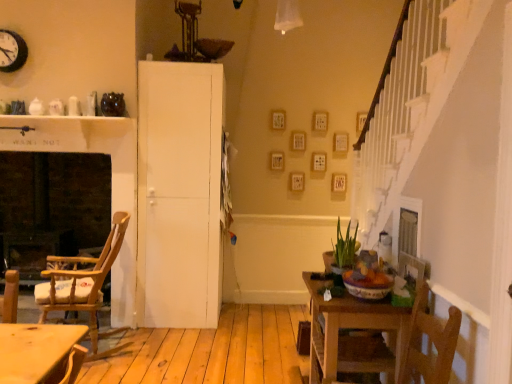
At what (x,y) coordinates should I click in order to perform the action: click on wooden rocking chair at left. Please return your answer as a coordinate pair (x, y). Image resolution: width=512 pixels, height=384 pixels. Looking at the image, I should click on (80, 280).

Describe the element at coordinates (342, 250) in the screenshot. The height and width of the screenshot is (384, 512). I see `green matte plant at center` at that location.

At what (x,y) coordinates should I click in order to perform the action: click on green matte plant at center. Please return your answer as a coordinate pair (x, y). Looking at the image, I should click on (342, 250).

Where is `brick fireplace at left`? This screenshot has width=512, height=384. brick fireplace at left is located at coordinates (51, 207).

Looking at the image, does brick fireplace at left seem bigger or smaller compared to white matte door at center?

Clearly, brick fireplace at left is smaller in size than white matte door at center.

Can you confirm if brick fireplace at left is positioned to the right of white matte door at center?

Incorrect, brick fireplace at left is not on the right side of white matte door at center.

Between brick fireplace at left and white matte door at center, which one has more height?

With more height is white matte door at center.

From the image's perspective, which object appears higher, green matte plant at center or white matte door at center?

white matte door at center appears higher in the image.

Which of these two, green matte plant at center or white matte door at center, is smaller?

green matte plant at center is smaller.

From a real-world perspective, who is located lower, green matte plant at center or white matte door at center?

From a 3D spatial view, green matte plant at center is below.

From a real-world perspective, is wooden rocking chair at left positioned over brick fireplace at left based on gravity?

Incorrect, from a real-world perspective, wooden rocking chair at left is lower than brick fireplace at left.

Consider the image. From the image's perspective, between wooden rocking chair at left and brick fireplace at left, who is located below?

wooden rocking chair at left.

Is point (97, 308) positioned before point (91, 227)?

Yes, it is.

Considering the relative positions of wooden rocking chair at left and brick fireplace at left in the image provided, is wooden rocking chair at left to the left of brick fireplace at left from the viewer's perspective?

No.

Is wooden table at lower right not near wooden rocking chair at left?

Indeed, wooden table at lower right is not near wooden rocking chair at left.

Is wooden table at lower right smaller than wooden rocking chair at left?

Yes.

Who is shorter, wooden table at lower right or wooden rocking chair at left?

Standing shorter between the two is wooden table at lower right.

Find the location of a particular element. kitchen & dining room table that is below the brick fireplace at left (from the image's perspective) is located at coordinates (354, 337).

Between wooden table at lower right and brick fireplace at left, which one appears on the left side from the viewer's perspective?

From the viewer's perspective, brick fireplace at left appears more on the left side.

Between point (326, 317) and point (38, 157), which one is positioned behind?

Point (38, 157)

Considering the relative positions of black metal clock at upper left and brick fireplace at left in the image provided, is black metal clock at upper left to the left or to the right of brick fireplace at left?

Clearly, black metal clock at upper left is on the right of brick fireplace at left in the image.

Relative to brick fireplace at left, is black metal clock at upper left in front or behind?

black metal clock at upper left is positioned closer to the viewer than brick fireplace at left.

From the image's perspective, is black metal clock at upper left over brick fireplace at left?

Yes.

From a real-world perspective, who is located higher, white matte door at center or brick fireplace at left?

white matte door at center is physically above.

Is white matte door at center in front of or behind brick fireplace at left in the image?

In the image, white matte door at center appears in front of brick fireplace at left.

Image resolution: width=512 pixels, height=384 pixels. Find the location of `fireplace directly beneath the white matte door at center (from a real-world perspective)`. fireplace directly beneath the white matte door at center (from a real-world perspective) is located at coordinates (51, 207).

Locate an element on the screen. The image size is (512, 384). fireplace located underneath the white matte door at center (from a real-world perspective) is located at coordinates (51, 207).

Find the location of a particular element. houseplant in front of the white matte door at center is located at coordinates (342, 250).

Considering their positions, is wooden table at lower right positioned closer to green matte plant at center than wooden rocking chair at left?

Among the two, wooden table at lower right is located nearer to green matte plant at center.

Estimate the real-world distances between objects in this image. Which object is further from wooden table at lower right, white matte door at center or green matte plant at center?

The object further to wooden table at lower right is white matte door at center.

Considering their positions, is white matte door at center positioned further to green matte plant at center than black metal clock at upper left?

black metal clock at upper left.

When comparing their distances from black metal clock at upper left, does wooden rocking chair at left or brick fireplace at left seem closer?

brick fireplace at left is positioned closer to the anchor black metal clock at upper left.

Which object lies further to the anchor point black metal clock at upper left, brick fireplace at left or white matte door at center?

white matte door at center is further to black metal clock at upper left.

From the image, which object appears to be farther from wooden table at lower right, brick fireplace at left or wooden rocking chair at left?

brick fireplace at left is further to wooden table at lower right.

From the image, which object appears to be farther from wooden rocking chair at left, green matte plant at center or wooden table at lower right?

green matte plant at center is positioned further to the anchor wooden rocking chair at left.

Estimate the real-world distances between objects in this image. Which object is closer to brick fireplace at left, white matte door at center or wooden rocking chair at left?

Among the two, wooden rocking chair at left is located nearer to brick fireplace at left.

Where is `cabinetry situated between brick fireplace at left and wooden table at lower right from left to right`? The image size is (512, 384). cabinetry situated between brick fireplace at left and wooden table at lower right from left to right is located at coordinates (179, 194).

In order to click on cabinetry that lies between black metal clock at upper left and wooden rocking chair at left from top to bottom in this screenshot , I will do click(x=179, y=194).

Locate an element on the screen. Image resolution: width=512 pixels, height=384 pixels. clock between brick fireplace at left and wooden table at lower right is located at coordinates (12, 51).

I want to click on cabinetry situated between wooden rocking chair at left and wooden table at lower right from left to right, so click(179, 194).